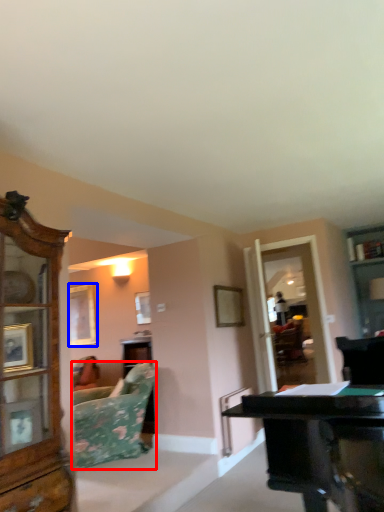
Question: Which of the following is the closest to the observer, studio couch (highlighted by a red box) or picture frame (highlighted by a blue box)?

Choices:
 (A) studio couch
 (B) picture frame

Answer: (A)